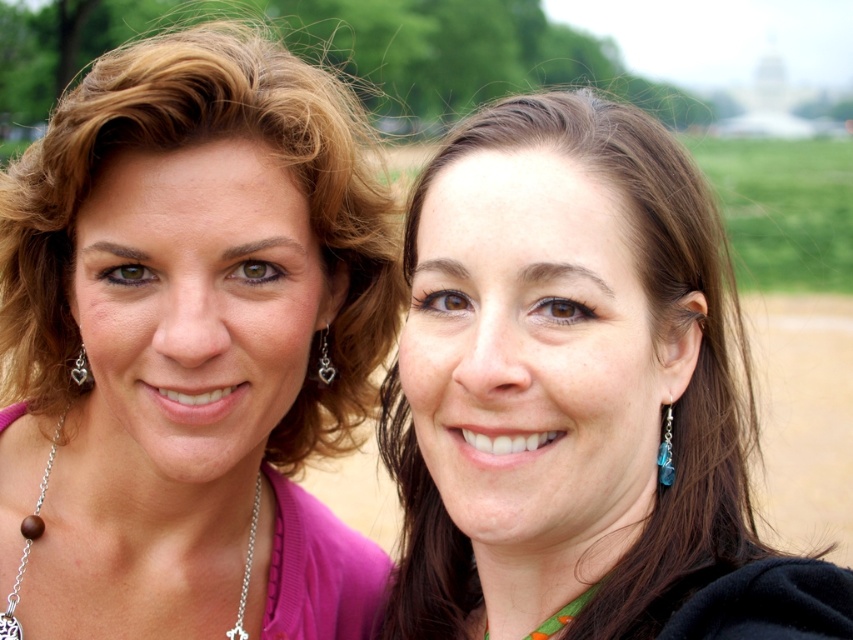
Which is below, smooth brown hair at center or silver/heart-shaped earring at left?

smooth brown hair at center is below.

Is smooth brown hair at center to the right of silver/heart-shaped earring at left from the viewer's perspective?

Yes, smooth brown hair at center is to the right of silver/heart-shaped earring at left.

Is point (422, 410) less distant than point (85, 364)?

That is True.

Identify the location of smooth brown hair at center. Image resolution: width=853 pixels, height=640 pixels. (577, 396).

Can you confirm if silver metallic chain at left is positioned to the left of blue glass earring at right?

Correct, you'll find silver metallic chain at left to the left of blue glass earring at right.

Which of these two, silver metallic chain at left or blue glass earring at right, stands taller?

silver metallic chain at left

Which is behind, point (13, 593) or point (666, 483)?

Point (13, 593)

Locate an element on the screen. Image resolution: width=853 pixels, height=640 pixels. silver metallic chain at left is located at coordinates (247, 566).

From the picture: Is smooth brown hair at center to the left of silver metallic chain at left from the viewer's perspective?

In fact, smooth brown hair at center is to the right of silver metallic chain at left.

Between smooth brown hair at center and silver metallic chain at left, which one is positioned higher?

Positioned higher is smooth brown hair at center.

What do you see at coordinates (577, 396) in the screenshot? I see `smooth brown hair at center` at bounding box center [577, 396].

This screenshot has width=853, height=640. I want to click on smooth brown hair at center, so click(577, 396).